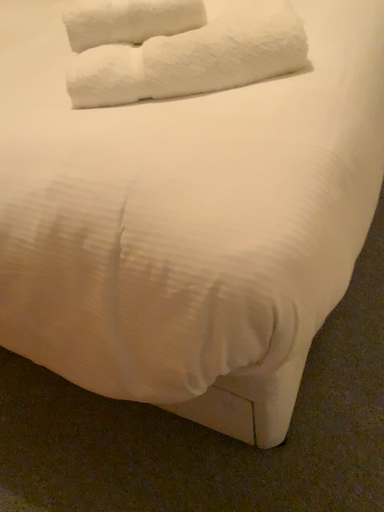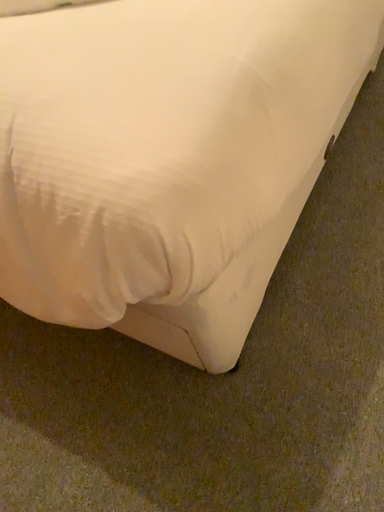
Question: How did the camera likely rotate when shooting the video?

Choices:
 (A) rotated upward
 (B) rotated downward

Answer: (B)